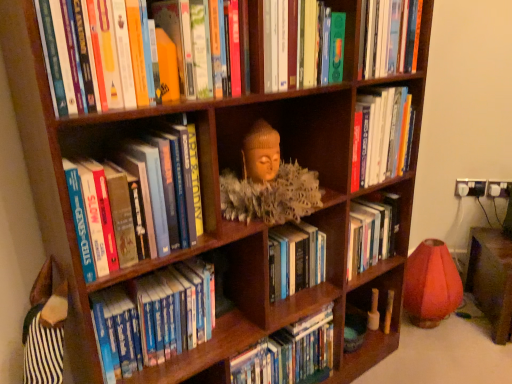
Question: Is green matte book at upper center, which is counted as the 1th book, starting from the top, positioned with its back to blue hardcover books at center, the fifth book positioned from the top?

Choices:
 (A) yes
 (B) no

Answer: (B)

Question: Does green matte book at upper center, which is counted as the 1th book, starting from the top, turn towards blue hardcover books at center, the fifth book positioned from the top?

Choices:
 (A) yes
 (B) no

Answer: (B)

Question: Does green matte book at upper center, which is counted as the 1th book, starting from the top, lie behind blue hardcover books at center, the second book positioned from the bottom?

Choices:
 (A) no
 (B) yes

Answer: (A)

Question: From a real-world perspective, is green matte book at upper center, placed as the 6th book when sorted from bottom to top, positioned over blue hardcover books at center, the second book positioned from the bottom, based on gravity?

Choices:
 (A) no
 (B) yes

Answer: (B)

Question: Can you confirm if green matte book at upper center, which is counted as the 1th book, starting from the top, is wider than blue hardcover books at center, the fifth book positioned from the top?

Choices:
 (A) no
 (B) yes

Answer: (B)

Question: Is green matte book at upper center, placed as the 6th book when sorted from bottom to top, placed right next to blue hardcover books at center, the fifth book positioned from the top?

Choices:
 (A) yes
 (B) no

Answer: (B)

Question: From a real-world perspective, is hardcover book at center, which ranks as the fourth book in top-to-bottom order, below matte wooden sculpture at center?

Choices:
 (A) yes
 (B) no

Answer: (A)

Question: Does hardcover book at center, which appears as the 3th book when ordered from the bottom, have a lesser height compared to matte wooden sculpture at center?

Choices:
 (A) yes
 (B) no

Answer: (A)

Question: Considering the relative sizes of hardcover book at center, which appears as the 3th book when ordered from the bottom, and matte wooden sculpture at center in the image provided, is hardcover book at center, which appears as the 3th book when ordered from the bottom, smaller than matte wooden sculpture at center?

Choices:
 (A) yes
 (B) no

Answer: (A)

Question: Can you confirm if hardcover book at center, which appears as the 3th book when ordered from the bottom, is positioned to the left of matte wooden sculpture at center?

Choices:
 (A) no
 (B) yes

Answer: (A)

Question: Are hardcover book at center, which ranks as the fourth book in top-to-bottom order, and matte wooden sculpture at center located far from each other?

Choices:
 (A) no
 (B) yes

Answer: (A)

Question: Is hardcover book at center, which ranks as the fourth book in top-to-bottom order, positioned behind matte wooden sculpture at center?

Choices:
 (A) no
 (B) yes

Answer: (B)

Question: Is green matte book at upper center, which is counted as the 1th book, starting from the top, facing towards hardcover books at left, positioned as the 3th book in top-to-bottom order?

Choices:
 (A) no
 (B) yes

Answer: (A)